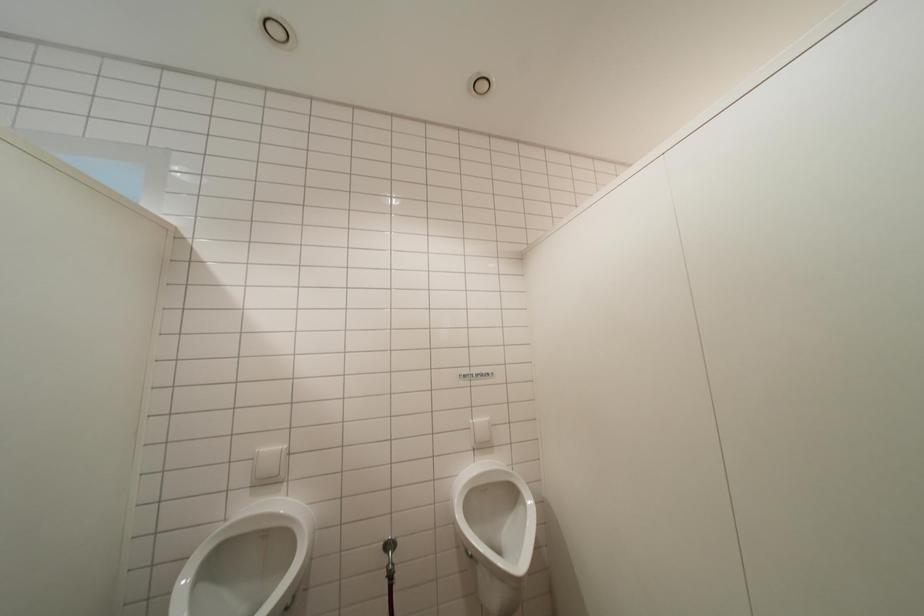
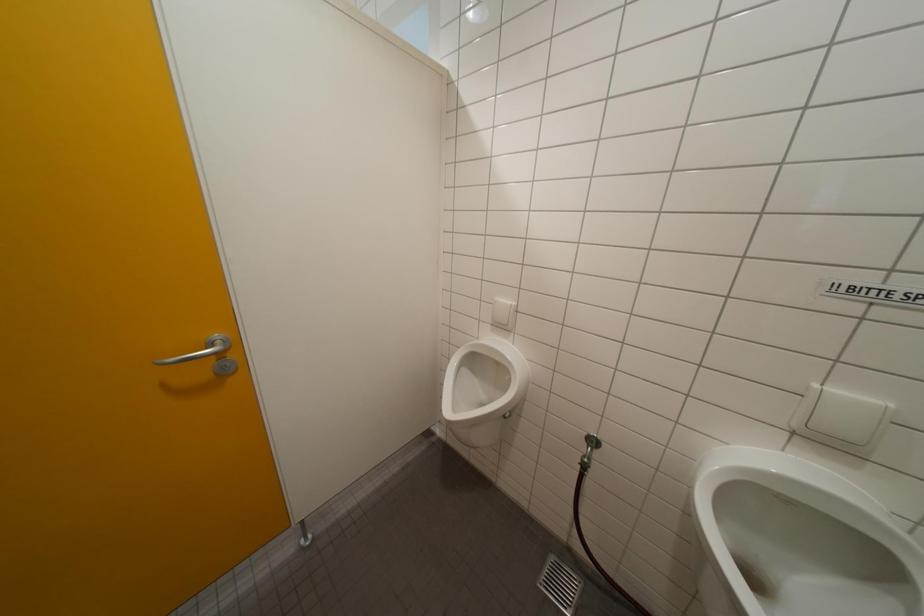
Based on the continuous images, in which direction is the camera rotating?

The camera's rotation is toward left-down.